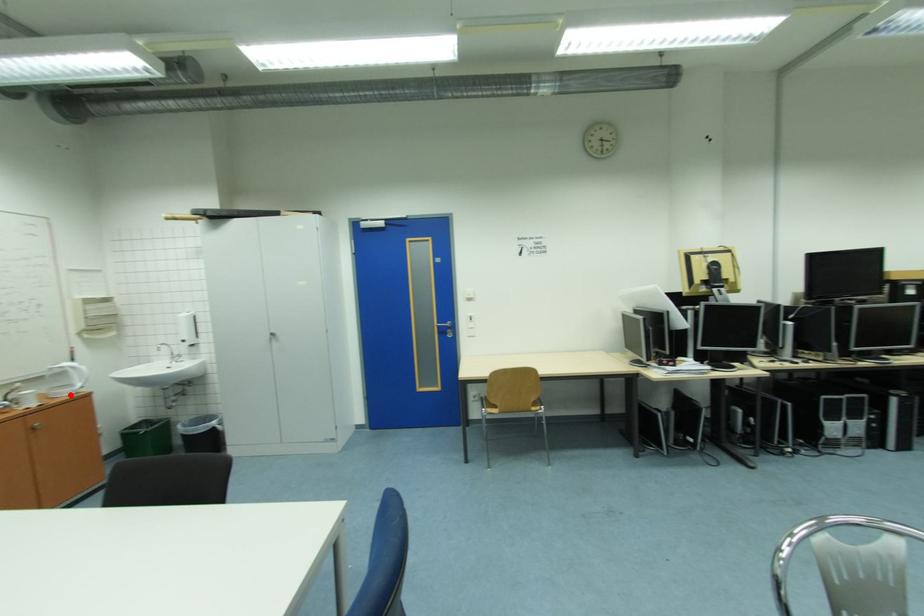
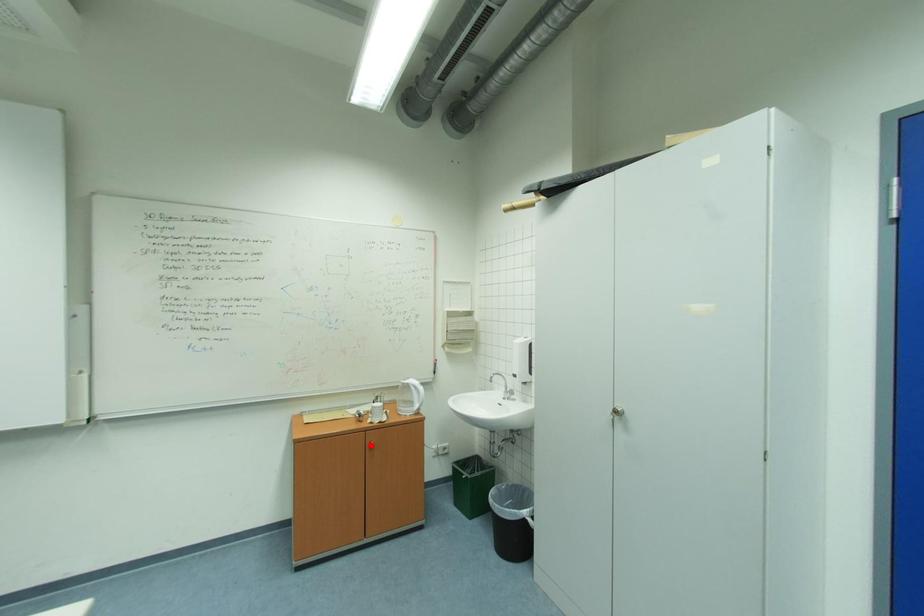
I am providing you with two images of the same scene from different viewpoints. A red point is marked on the first image and another point is marked on the second image. Are the points marked in image1 and image2 representing the same 3D position?

No